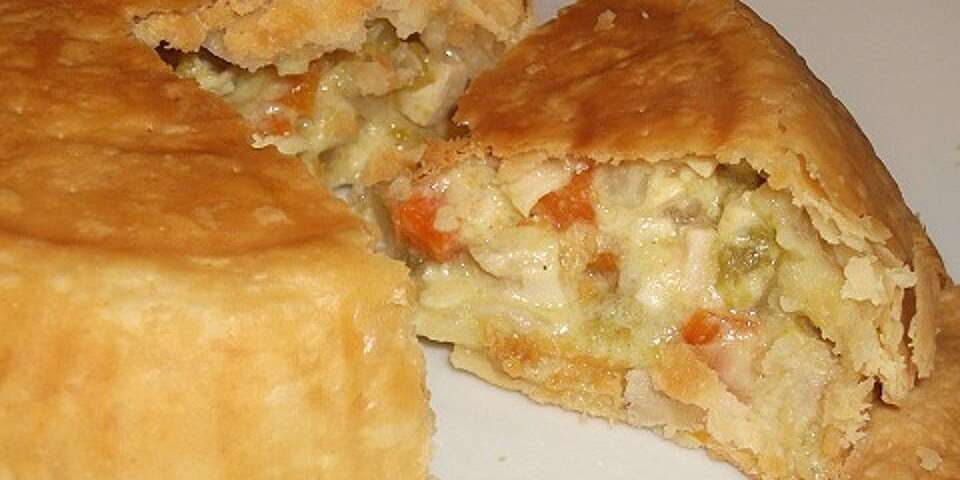
At what (x,y) coordinates should I click in order to perform the action: click on white table top. Please return your answer as a coordinate pair (x, y). The width and height of the screenshot is (960, 480). Looking at the image, I should click on click(553, 460).